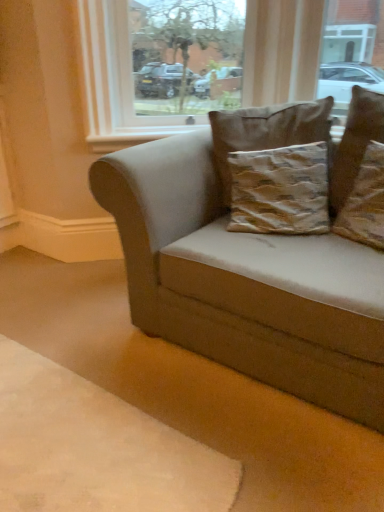
The height and width of the screenshot is (512, 384). Find the location of `blank space situated above beige fabric dog bed at lower right (from a real-world perspective)`. blank space situated above beige fabric dog bed at lower right (from a real-world perspective) is located at coordinates (53, 424).